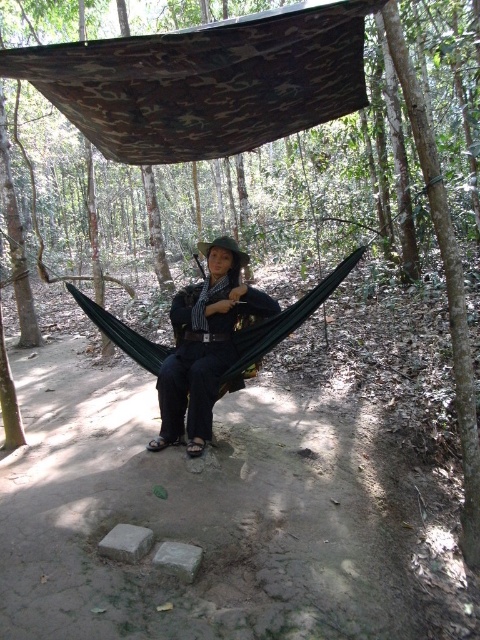
You are planning to hang a new hammock in the forest. You have two options shown in the image. The camo fabric hammock at upper center and the dark blue fabric hammock at center. Which one is shorter in height?

The camo fabric hammock at upper center is not as tall as the dark blue fabric hammock at center, so the camo fabric hammock at upper center is shorter in height.

Based on the photo, you are a hiker trying to decide which hammock to use for shade. You want the one that is closer to you. Which hammock should you choose between the camo fabric hammock at upper center and the dark blue fabric hammock at center?

You should choose the camo fabric hammock at upper center because it is closer to the viewer than the dark blue fabric hammock at center.

You are standing at the origin point in the forest scene. There is a point located at coordinates [205,81]. Which object in the scene does this point belong to?

The point at coordinates [205,81] is on the camo fabric hammock at upper center.